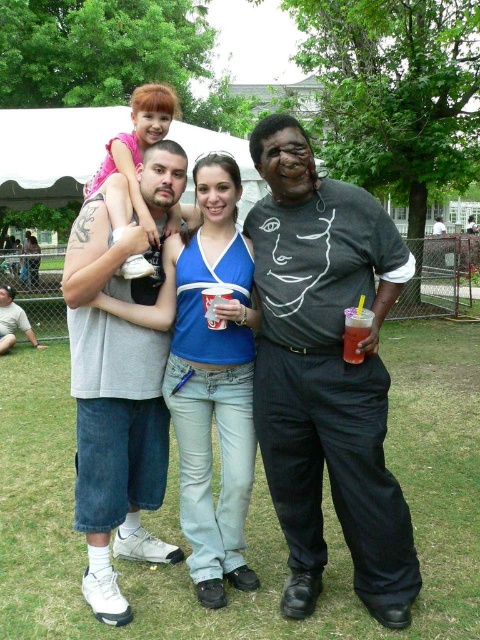
From the picture: Does blue denim jeans at center have a greater width compared to brushed metal water at bottle left?

No, blue denim jeans at center is not wider than brushed metal water at bottle left.

Which is more to the left, blue denim jeans at center or brushed metal water at bottle left?

Positioned to the left is brushed metal water at bottle left.

Is point (245, 369) positioned before point (4, 316)?

Yes.

At what (x,y) coordinates should I click in order to perform the action: click on blue denim jeans at center. Please return your answer as a coordinate pair (x, y). Image resolution: width=480 pixels, height=640 pixels. Looking at the image, I should click on (214, 385).

Is matte pink shirt at upper left to the right of translucent plastic cup at center from the viewer's perspective?

No, matte pink shirt at upper left is not to the right of translucent plastic cup at center.

Does matte pink shirt at upper left appear over translucent plastic cup at center?

Indeed, matte pink shirt at upper left is positioned over translucent plastic cup at center.

Who is more forward, [135,154] or [220,301]?

Positioned in front is point [220,301].

Locate an element on the screen. This screenshot has width=480, height=640. matte pink shirt at upper left is located at coordinates (133, 157).

Can you confirm if matte pink shirt at upper left is positioned above brushed metal water at bottle left?

Correct, matte pink shirt at upper left is located above brushed metal water at bottle left.

This screenshot has height=640, width=480. What do you see at coordinates (133, 157) in the screenshot? I see `matte pink shirt at upper left` at bounding box center [133, 157].

Identify the location of matte pink shirt at upper left. (133, 157).